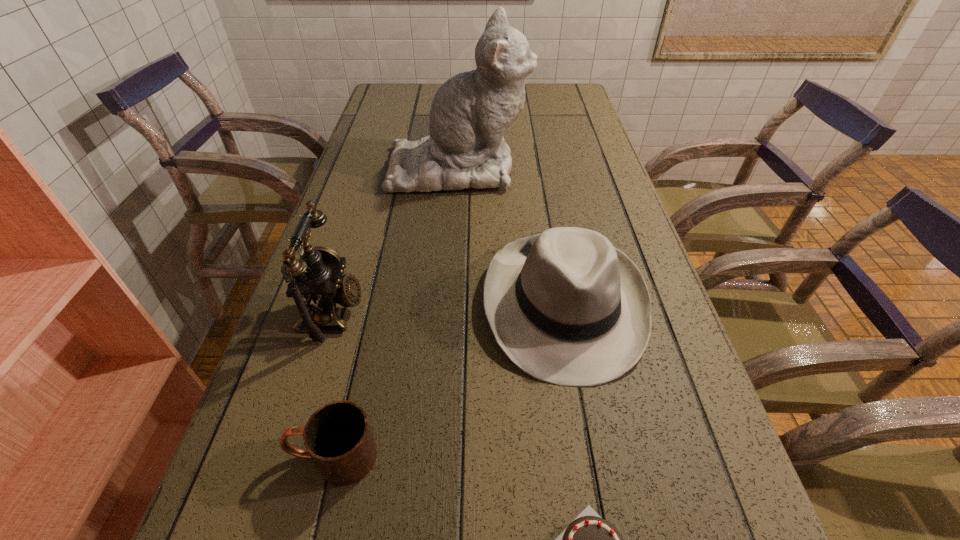
I want to click on telephone that is at the left edge, so click(x=316, y=282).

The image size is (960, 540). What are the coordinates of `mug that is at the left edge` in the screenshot? It's located at (338, 438).

Locate an element on the screen. This screenshot has width=960, height=540. object positioned at the right edge is located at coordinates (566, 307).

The height and width of the screenshot is (540, 960). What are the coordinates of `free region at the far edge of the desktop` in the screenshot? It's located at (428, 85).

Where is `free space at the left edge`? free space at the left edge is located at coordinates (251, 465).

The height and width of the screenshot is (540, 960). In order to click on free space at the right edge in this screenshot , I will do `click(552, 121)`.

Image resolution: width=960 pixels, height=540 pixels. Identify the location of vacant space at the far left corner of the desktop. (380, 106).

In the image, there is a desktop. Where is `vacant space at the far right corner`? vacant space at the far right corner is located at coordinates (564, 93).

The width and height of the screenshot is (960, 540). In order to click on free spot between the fourth shortest object and the tallest object in this screenshot , I will do (x=396, y=239).

Where is `free space between the fedora and the telephone`? free space between the fedora and the telephone is located at coordinates (448, 308).